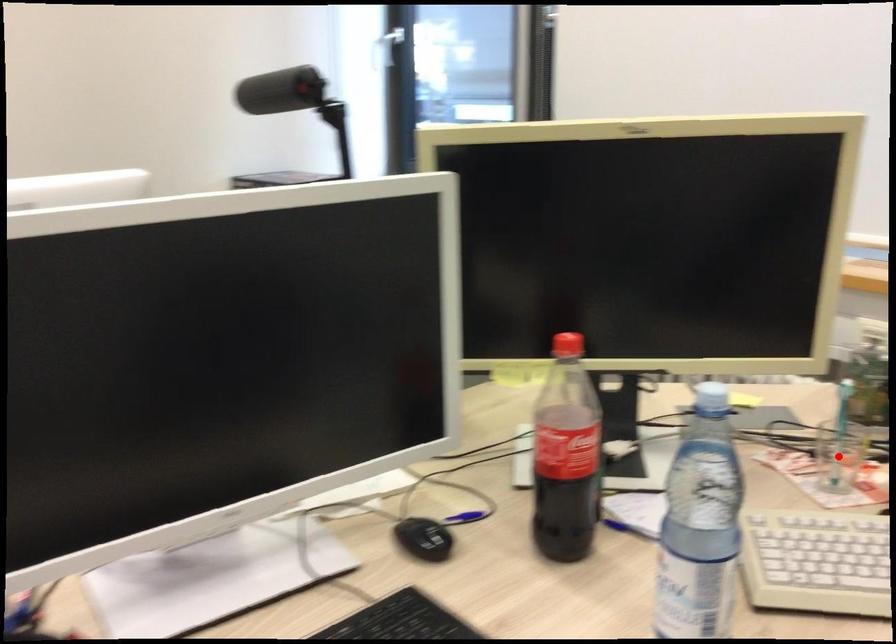
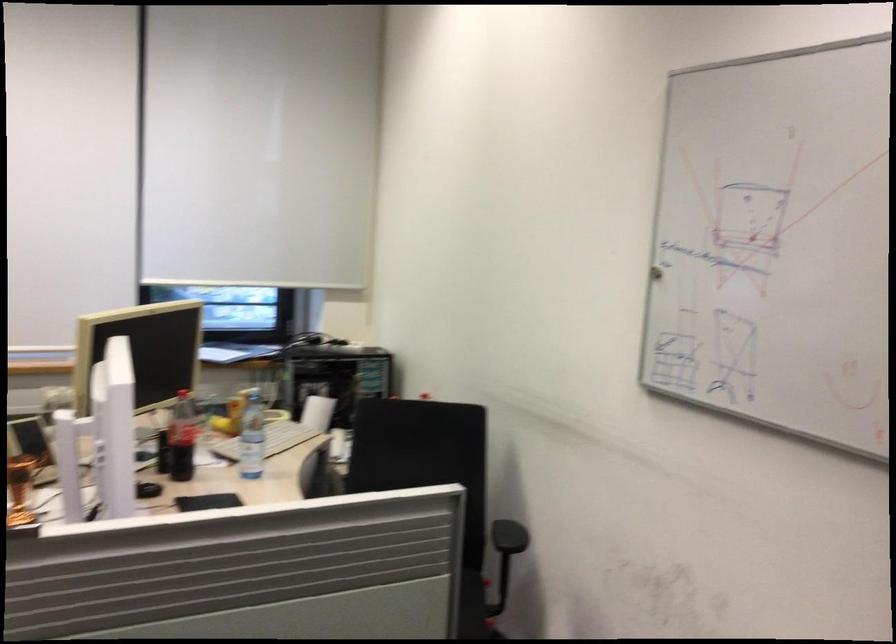
Question: I am providing you with two images of the same scene from different viewpoints. A red point is marked on the first image. Is the red point's position out of view in image 2?

Choices:
 (A) Yes
 (B) No

Answer: (A)